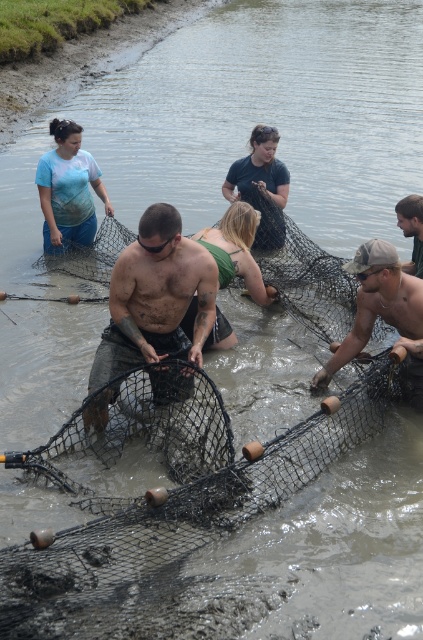
Question: Which of the following is the farthest from the observer?

Choices:
 (A) rusty metal net at center
 (B) dirty black net at center
 (C) dark brown leather jacket at upper right

Answer: (C)

Question: Does light blue t-shirt at upper left appear under dark brown leather jacket at upper right?

Choices:
 (A) no
 (B) yes

Answer: (A)

Question: Which object is closer to the camera taking this photo?

Choices:
 (A) rusty metal net at center
 (B) dark brown leather jacket at upper right
 (C) light blue t-shirt at upper left
 (D) dirty black net at center

Answer: (D)

Question: Where is rusty metal net at center located in relation to light blue t-shirt at upper left in the image?

Choices:
 (A) left
 (B) right

Answer: (B)

Question: Based on their relative distances, which object is nearer to the light blue t-shirt at upper left?

Choices:
 (A) dirty black net at center
 (B) rusty metal net at center
 (C) dark brown leather jacket at upper right

Answer: (C)

Question: In this image, where is light blue t-shirt at upper left located relative to dark brown leather jacket at upper right?

Choices:
 (A) left
 (B) right

Answer: (A)